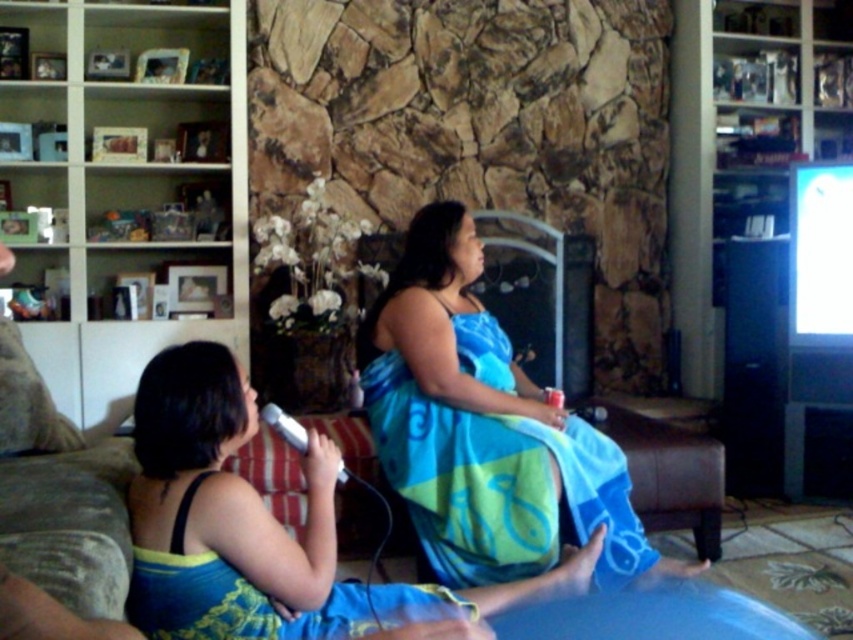
You are standing at the center of the living room and want to sit down on the velvet brown couch at lower left. In which direction should you move to reach it?

You should move to the lower left direction to reach the velvet brown couch at lower left, as it is located at point (57, 493).

You are standing in the living room and want to place a small plant pot exactly where the blue fabric dress at center is currently located. Is this possible?

The blue fabric dress at center is located at coordinates point (485, 429), so yes, you can place the small plant pot there as long as the space is accessible and clear.

You are a guest entering the living room and want to sit on the velvet brown couch at lower left. Where should you walk to avoid the blue fabric dress at center?

The blue fabric dress at center is on the right side of the velvet brown couch at lower left, so you should walk to the left side of the velvet brown couch at lower left to avoid it.